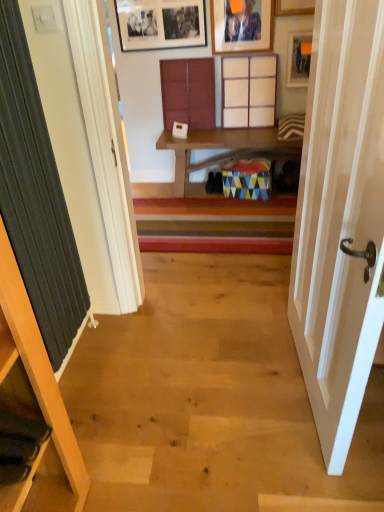
Question: Can you confirm if matte wooden picture frame at upper right, which is the 1th picture frame in right-to-left order, is smaller than matte wood cabinet at center, arranged as the first cabinet when viewed from the top?

Choices:
 (A) yes
 (B) no

Answer: (A)

Question: Is matte wooden picture frame at upper right, the third picture frame positioned from the left, taller than matte wood cabinet at center, which is the 2th cabinet from right to left?

Choices:
 (A) yes
 (B) no

Answer: (B)

Question: Does matte wooden picture frame at upper right, the third picture frame positioned from the left, come behind matte wood cabinet at center, which is the 2th cabinet from right to left?

Choices:
 (A) yes
 (B) no

Answer: (B)

Question: Is matte wooden picture frame at upper right, which is the 1th picture frame in right-to-left order, aimed at matte wood cabinet at center, the 3th cabinet when ordered from bottom to top?

Choices:
 (A) yes
 (B) no

Answer: (B)

Question: From the image's perspective, is matte wooden picture frame at upper right, the third picture frame positioned from the left, located beneath matte wood cabinet at center, arranged as the first cabinet when viewed from the top?

Choices:
 (A) no
 (B) yes

Answer: (A)

Question: Does matte wooden picture frame at upper right, the third picture frame positioned from the left, have a larger size compared to matte wood cabinet at center, the 2th cabinet in the left-to-right sequence?

Choices:
 (A) yes
 (B) no

Answer: (B)

Question: Is black matte picture frame at upper center, which is the 1th picture frame in left-to-right order, to the left of wooden cabinet at upper center, which appears as the 2th cabinet when ordered from the bottom, from the viewer's perspective?

Choices:
 (A) no
 (B) yes

Answer: (B)

Question: Does black matte picture frame at upper center, which is the 1th picture frame in left-to-right order, have a lesser width compared to wooden cabinet at upper center, the 3th cabinet in the left-to-right sequence?

Choices:
 (A) no
 (B) yes

Answer: (B)

Question: From a real-world perspective, is black matte picture frame at upper center, which is the 1th picture frame in left-to-right order, positioned over wooden cabinet at upper center, the 3th cabinet in the left-to-right sequence, based on gravity?

Choices:
 (A) yes
 (B) no

Answer: (A)

Question: Can you confirm if black matte picture frame at upper center, which is the 1th picture frame in left-to-right order, is taller than wooden cabinet at upper center, the 3th cabinet in the left-to-right sequence?

Choices:
 (A) yes
 (B) no

Answer: (B)

Question: Are black matte picture frame at upper center, marked as the 3th picture frame in a right-to-left arrangement, and wooden cabinet at upper center, which is the second cabinet from front to back, located far from each other?

Choices:
 (A) yes
 (B) no

Answer: (B)

Question: Is black matte picture frame at upper center, marked as the 3th picture frame in a right-to-left arrangement, wider than wooden cabinet at upper center, which appears as the 2th cabinet when ordered from the bottom?

Choices:
 (A) yes
 (B) no

Answer: (B)

Question: Can you confirm if matte wooden picture frame at upper right, which is the 1th picture frame in right-to-left order, is smaller than matte wooden picture frame at upper center, arranged as the second picture frame when viewed from the right?

Choices:
 (A) yes
 (B) no

Answer: (A)